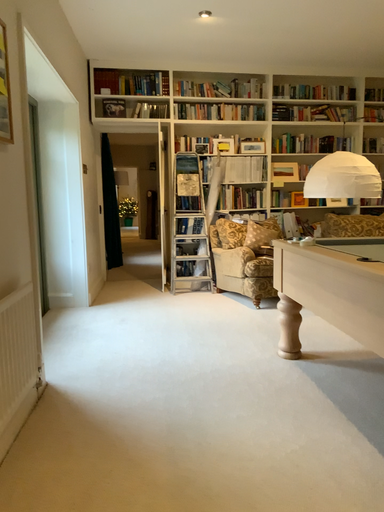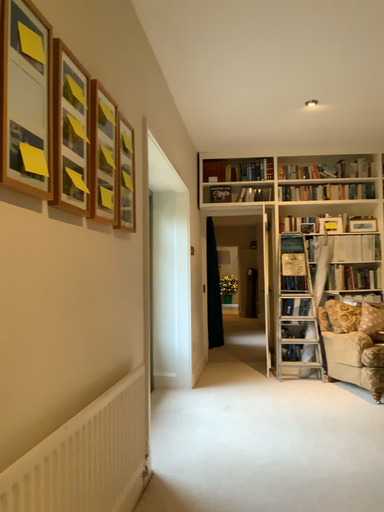
Question: Which way did the camera rotate in the video?

Choices:
 (A) rotated left
 (B) rotated right

Answer: (A)